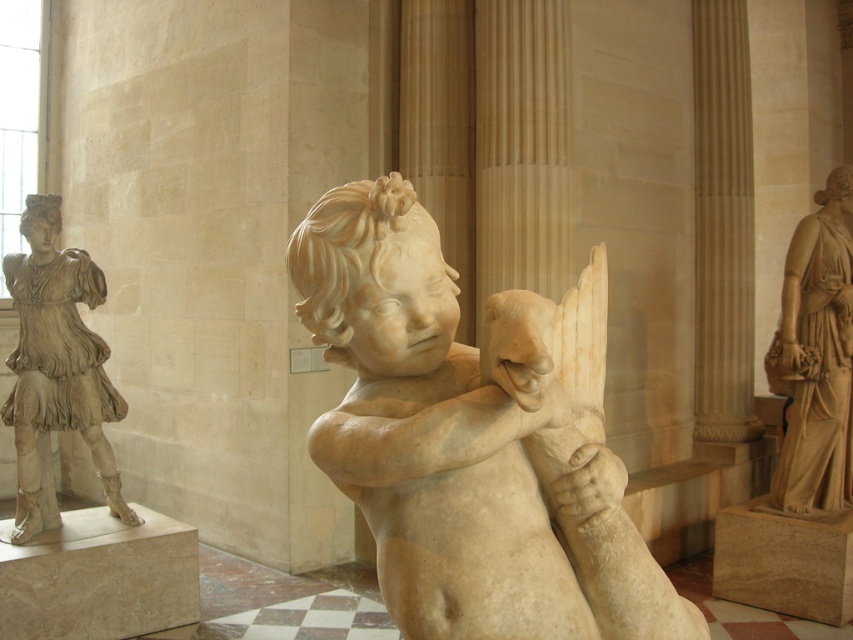
In the scene shown: You are standing in front of the classical sculpture of a cherub in the museum. There are two points on the sculpture labeled as point A and point B. Point A is located at coordinates point A at position (613,529) and point B is at coordinates point B at position (115,413). Which point is closer to you?

Point A at position (613,529) is closer to the viewer than point B at position (115,413).

You are an art curator planning to move the matte beige statue at left and the marble statue at right to a new exhibition space. Which statue should be moved first to ensure the other can be placed in its original position without obstruction?

The marble statue at right should be moved first because the matte beige statue at left is positioned under it, so removing the upper statue first allows the lower one to be moved without obstruction.